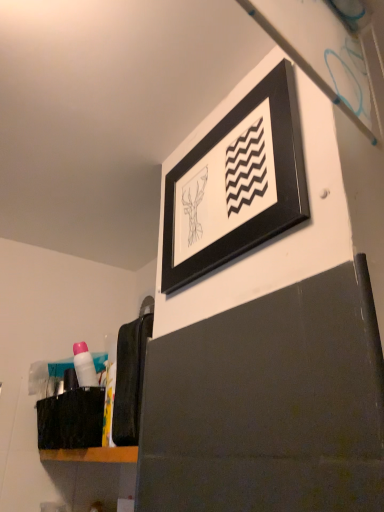
Question: Is black fabric laundry at lower left shorter than pink plastic tube at lower left?

Choices:
 (A) no
 (B) yes

Answer: (A)

Question: Can you confirm if black fabric laundry at lower left is thinner than pink plastic tube at lower left?

Choices:
 (A) yes
 (B) no

Answer: (B)

Question: Is black fabric laundry at lower left turned away from pink plastic tube at lower left?

Choices:
 (A) yes
 (B) no

Answer: (B)

Question: Is there a large distance between black fabric laundry at lower left and pink plastic tube at lower left?

Choices:
 (A) no
 (B) yes

Answer: (A)

Question: Is the depth of black fabric laundry at lower left greater than that of pink plastic tube at lower left?

Choices:
 (A) yes
 (B) no

Answer: (B)

Question: Considering the relative sizes of black fabric laundry at lower left and pink plastic tube at lower left in the image provided, is black fabric laundry at lower left smaller than pink plastic tube at lower left?

Choices:
 (A) yes
 (B) no

Answer: (B)

Question: Is black matte picture frame at upper center positioned beyond the bounds of black fabric laundry at lower left?

Choices:
 (A) yes
 (B) no

Answer: (A)

Question: Can you confirm if black matte picture frame at upper center is bigger than black fabric laundry at lower left?

Choices:
 (A) yes
 (B) no

Answer: (A)

Question: Would you say black matte picture frame at upper center is a long distance from black fabric laundry at lower left?

Choices:
 (A) no
 (B) yes

Answer: (A)

Question: Does black matte picture frame at upper center have a greater width compared to black fabric laundry at lower left?

Choices:
 (A) no
 (B) yes

Answer: (A)

Question: Is black matte picture frame at upper center to the right of black fabric laundry at lower left from the viewer's perspective?

Choices:
 (A) yes
 (B) no

Answer: (A)

Question: Does black matte picture frame at upper center have a greater height compared to black fabric laundry at lower left?

Choices:
 (A) no
 (B) yes

Answer: (B)

Question: Is the position of pink plastic tube at lower left more distant than that of black fabric laundry at lower left?

Choices:
 (A) yes
 (B) no

Answer: (A)